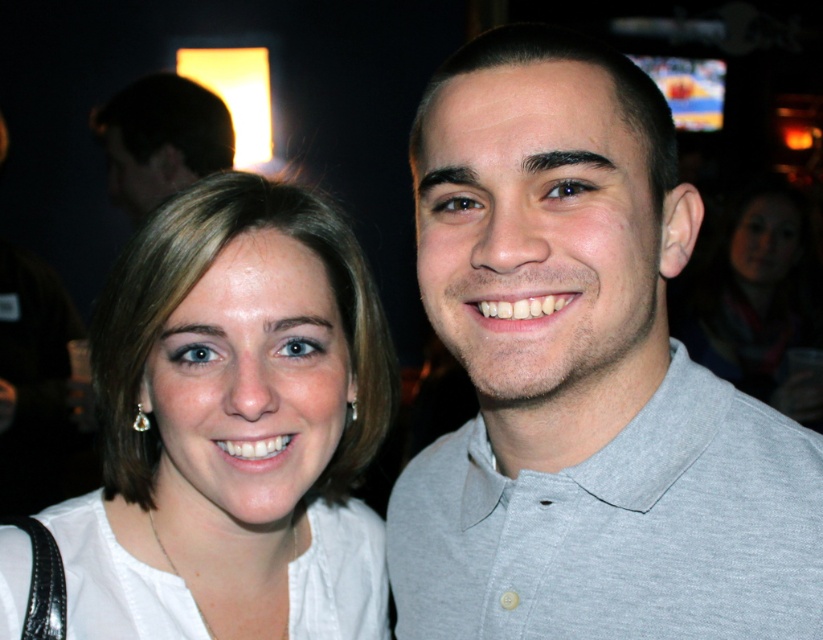
Question: Does white matte shirt at left appear on the right side of white cotton shirt at center?

Choices:
 (A) no
 (B) yes

Answer: (B)

Question: Can you confirm if gray cotton polo shirt at center is bigger than dark brown hair at upper left?

Choices:
 (A) no
 (B) yes

Answer: (A)

Question: Does gray cotton polo shirt at center have a lesser width compared to gray cotton polo shirt at right?

Choices:
 (A) yes
 (B) no

Answer: (A)

Question: Which object is positioned closest to the white cotton shirt at center?

Choices:
 (A) dark brown hair at upper left
 (B) gray cotton polo shirt at right
 (C) white matte shirt at left
 (D) gray cotton polo shirt at center

Answer: (C)

Question: Estimate the real-world distances between objects in this image. Which object is farther from the white matte shirt at left?

Choices:
 (A) gray cotton polo shirt at right
 (B) gray cotton polo shirt at center
 (C) dark brown hair at upper left
 (D) white cotton shirt at center

Answer: (C)

Question: Which object is the farthest from the white cotton shirt at center?

Choices:
 (A) white matte shirt at left
 (B) gray cotton polo shirt at center
 (C) dark brown hair at upper left

Answer: (C)